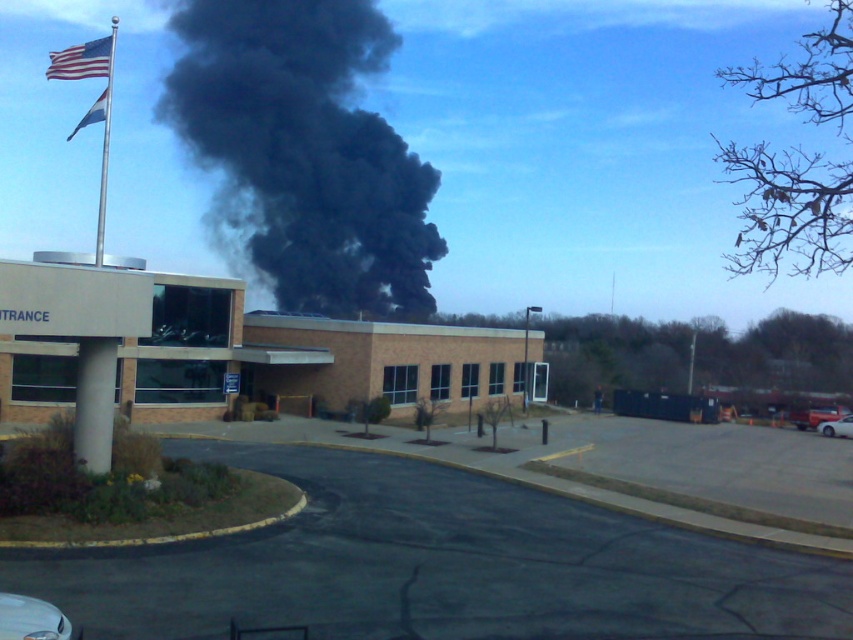
Question: Which of the following is the farthest from the observer?

Choices:
 (A) (280, 188)
 (B) (91, 52)

Answer: (A)

Question: Does black smoke at upper center appear on the right side of american flag at upper left?

Choices:
 (A) yes
 (B) no

Answer: (A)

Question: In this image, where is black smoke at upper center located relative to american flag at upper left?

Choices:
 (A) right
 (B) left

Answer: (A)

Question: Which object is closer to the camera taking this photo?

Choices:
 (A) black smoke at upper center
 (B) american flag at upper left

Answer: (B)

Question: Which object is closer to the camera taking this photo?

Choices:
 (A) black smoke at upper center
 (B) american flag at upper left

Answer: (B)

Question: Is black smoke at upper center further to camera compared to american flag at upper left?

Choices:
 (A) no
 (B) yes

Answer: (B)